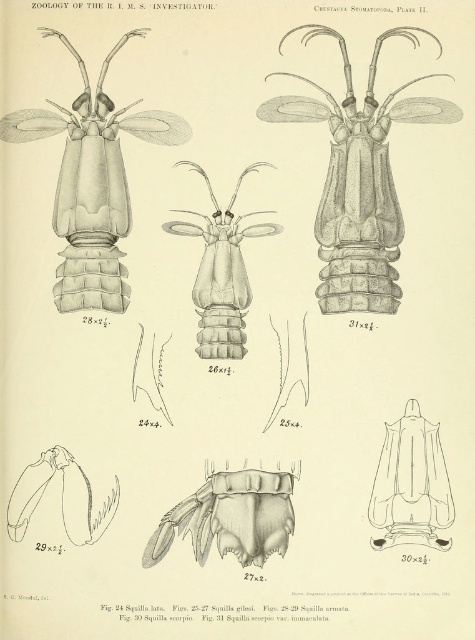
Question: Which of the following is the farthest from the observer?

Choices:
 (A) matte gray crustacean at upper left
 (B) grayish-brown exoskeleton at center
 (C) transparent plastic scorpion at lower right

Answer: (B)

Question: Is transparent plastic scorpion at lower right wider than transparent glass insect at center?

Choices:
 (A) no
 (B) yes

Answer: (A)

Question: Can you confirm if grayish-brown exoskeleton at center is positioned below matte gray crustacean at upper left?

Choices:
 (A) no
 (B) yes

Answer: (A)

Question: Which of the following is the closest to the observer?

Choices:
 (A) transparent glass insect at center
 (B) grayish-brown exoskeleton at center
 (C) transparent plastic scorpion at lower right
 (D) matte gray crustacean at upper left

Answer: (C)

Question: Does transparent plastic scorpion at lower right come in front of transparent glass insect at center?

Choices:
 (A) no
 (B) yes

Answer: (B)

Question: Which of the following is the farthest from the observer?

Choices:
 (A) (241, 356)
 (B) (272, 538)
 (C) (95, 305)
 (D) (401, 509)

Answer: (A)